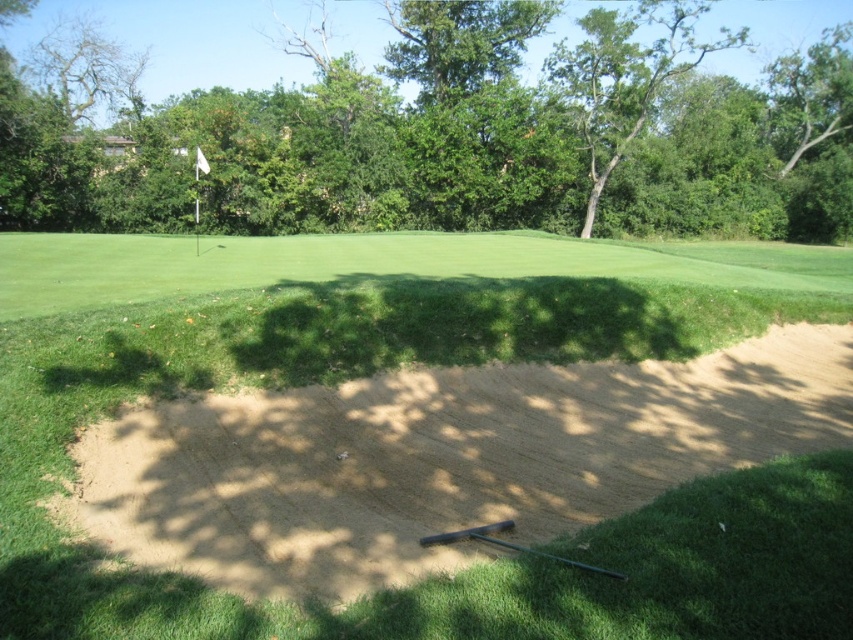
Who is taller, green grass at center or green leafy tree at upper center?

With more height is green leafy tree at upper center.

Who is more forward, (701, 593) or (544, 227)?

Point (701, 593) is more forward.

Which is in front, point (561, 572) or point (476, 1)?

Point (561, 572) is in front.

In order to click on green grass at center in this screenshot , I will do `click(407, 364)`.